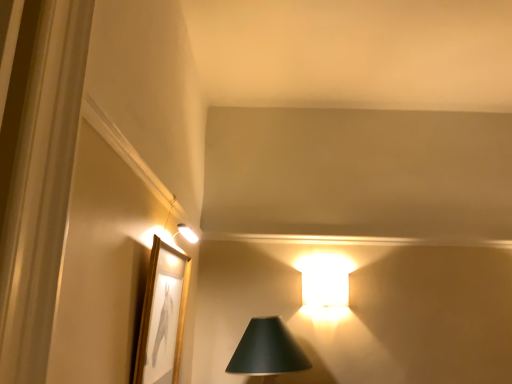
Question: From a real-world perspective, is gold/glossy picture frame at upper left over matte black lampshade at lower center?

Choices:
 (A) yes
 (B) no

Answer: (A)

Question: Is gold/glossy picture frame at upper left closer to the viewer compared to matte black lampshade at lower center?

Choices:
 (A) yes
 (B) no

Answer: (A)

Question: Can you confirm if gold/glossy picture frame at upper left is wider than matte black lampshade at lower center?

Choices:
 (A) yes
 (B) no

Answer: (B)

Question: Is gold/glossy picture frame at upper left further to the viewer compared to matte black lampshade at lower center?

Choices:
 (A) no
 (B) yes

Answer: (A)

Question: From the image's perspective, is gold/glossy picture frame at upper left beneath matte black lampshade at lower center?

Choices:
 (A) no
 (B) yes

Answer: (A)

Question: Is matte black lampshade at lower center located within gold/glossy picture frame at upper left?

Choices:
 (A) no
 (B) yes

Answer: (A)

Question: Could you tell me if matte black lampshade at lower center is turned towards gold/glossy picture frame at upper left?

Choices:
 (A) no
 (B) yes

Answer: (A)

Question: Considering the relative sizes of matte black lampshade at lower center and gold/glossy picture frame at upper left in the image provided, is matte black lampshade at lower center wider than gold/glossy picture frame at upper left?

Choices:
 (A) yes
 (B) no

Answer: (A)

Question: Would you say gold/glossy picture frame at upper left is part of matte black lampshade at lower center's contents?

Choices:
 (A) no
 (B) yes

Answer: (A)

Question: From the image's perspective, is matte black lampshade at lower center located beneath gold/glossy picture frame at upper left?

Choices:
 (A) yes
 (B) no

Answer: (A)

Question: Considering the relative sizes of matte black lampshade at lower center and gold/glossy picture frame at upper left in the image provided, is matte black lampshade at lower center shorter than gold/glossy picture frame at upper left?

Choices:
 (A) no
 (B) yes

Answer: (B)

Question: Can you confirm if matte black lampshade at lower center is smaller than gold/glossy picture frame at upper left?

Choices:
 (A) yes
 (B) no

Answer: (B)

Question: In terms of size, does gold/glossy picture frame at upper left appear bigger or smaller than matte black lampshade at lower center?

Choices:
 (A) big
 (B) small

Answer: (B)